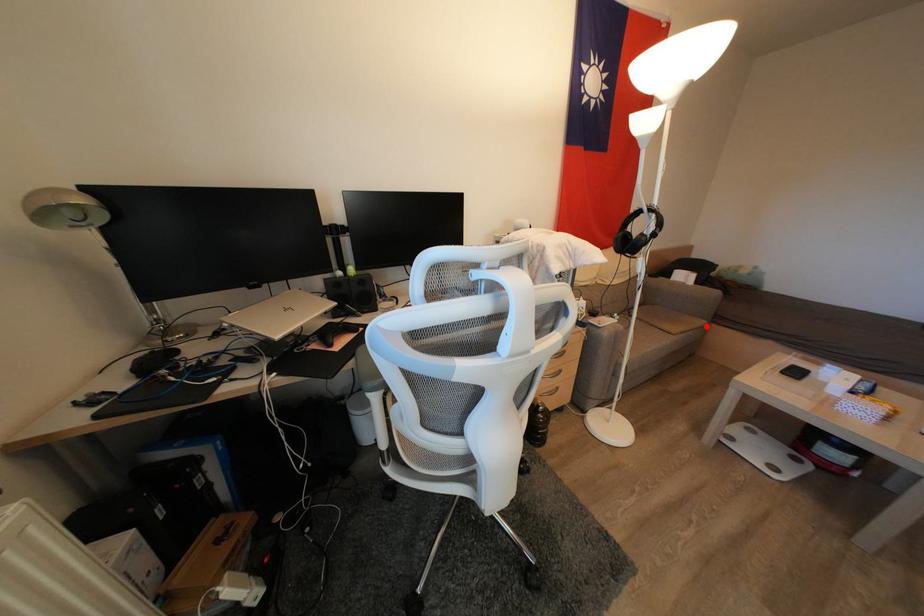
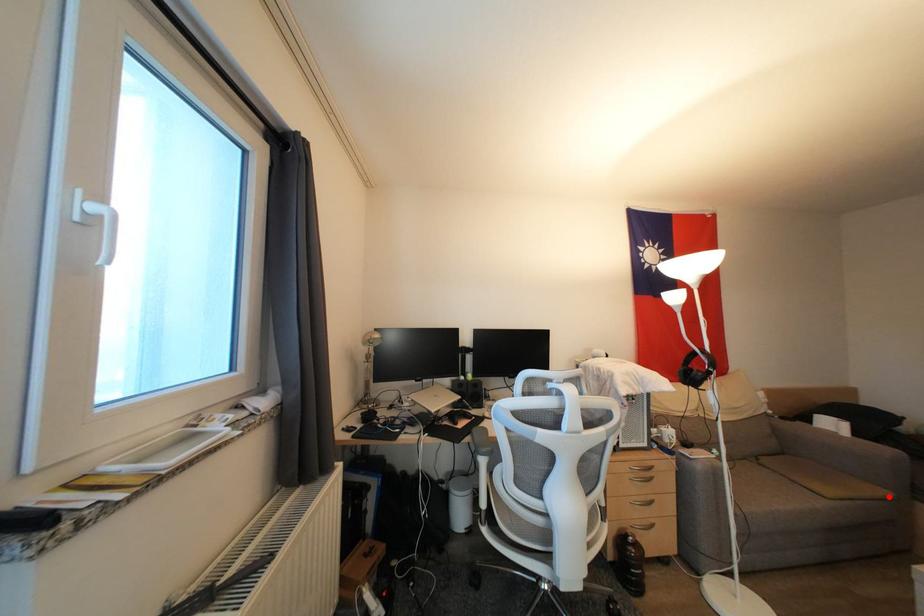
I am providing you with two images of the same scene from different viewpoints. A red point is marked on the first image and another point is marked on the second image. Is the marked point in image1 the same physical position as the marked point in image2?

Yes